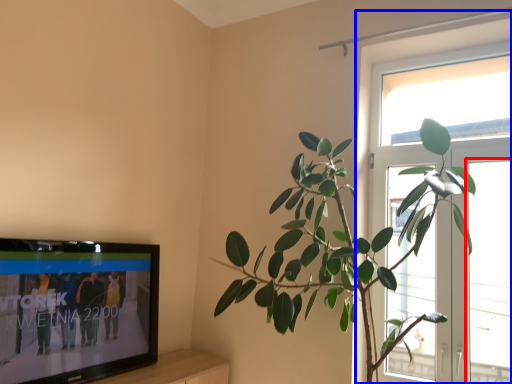
Question: Which point is closer to the camera, window (highlighted by a red box) or window (highlighted by a blue box)?

Choices:
 (A) window
 (B) window

Answer: (A)